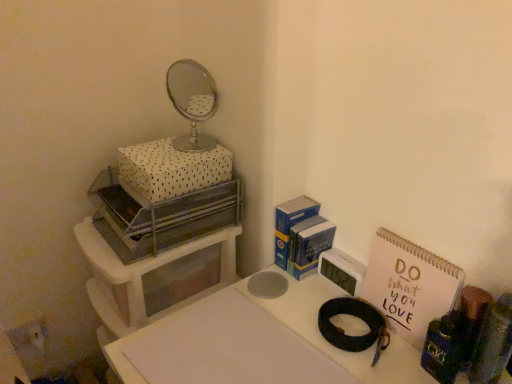
Where is `free location above white dotted fabric box at upper left (from a real-world perspective)`? free location above white dotted fabric box at upper left (from a real-world perspective) is located at coordinates (170, 147).